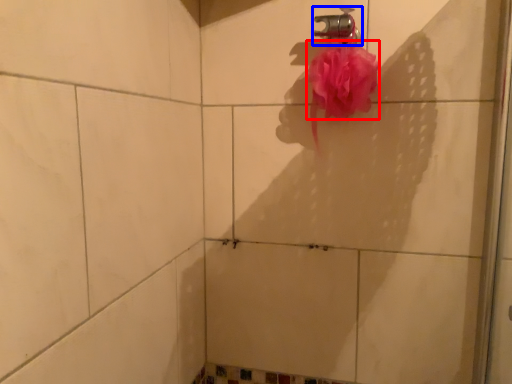
Question: Which object is further to the camera taking this photo, blood (highlighted by a red box) or plumbing fixture (highlighted by a blue box)?

Choices:
 (A) blood
 (B) plumbing fixture

Answer: (B)